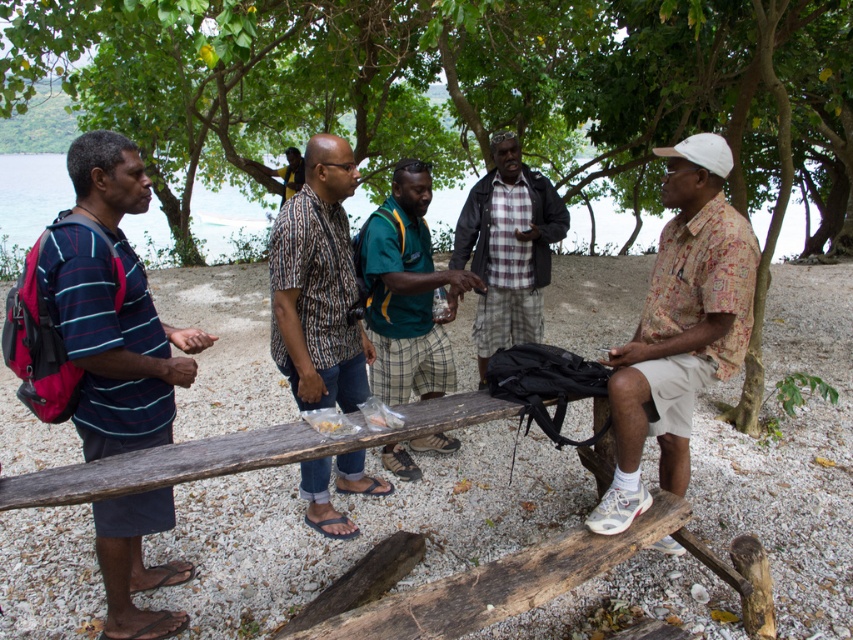
Is printed cotton shirt at center positioned before green fabric shirt at center?

Yes, printed cotton shirt at center is in front of green fabric shirt at center.

Who is lower down, printed cotton shirt at center or green fabric shirt at center?

printed cotton shirt at center is below.

Where is `printed cotton shirt at center`? printed cotton shirt at center is located at coordinates (318, 284).

Is printed cotton shirt at center positioned behind plaid fabric shirt at center?

No, printed cotton shirt at center is closer to the viewer.

Looking at this image, does printed cotton shirt at center appear over plaid fabric shirt at center?

No.

This screenshot has width=853, height=640. Find the location of `printed cotton shirt at center`. printed cotton shirt at center is located at coordinates (318, 284).

Where is `printed cotton shirt at center`? printed cotton shirt at center is located at coordinates (318, 284).

Does green leafy tree at upper center appear over printed cotton shirt at right?

Correct, green leafy tree at upper center is located above printed cotton shirt at right.

In the scene shown: Which is more to the right, green leafy tree at upper center or printed cotton shirt at right?

From the viewer's perspective, printed cotton shirt at right appears more on the right side.

Between point (434, 147) and point (621, 346), which one is positioned behind?

Positioned behind is point (434, 147).

This screenshot has height=640, width=853. I want to click on green leafy tree at upper center, so (451, 86).